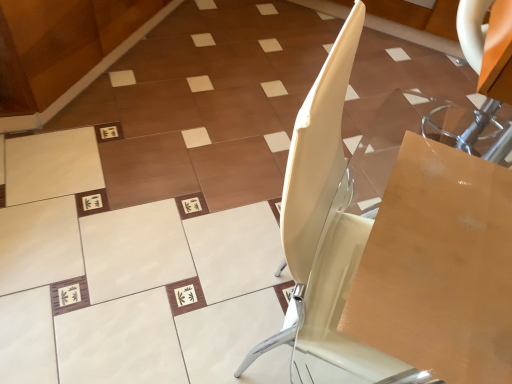
The width and height of the screenshot is (512, 384). In order to click on wooden cardboard box at center-right in this screenshot , I will do `click(439, 266)`.

Where is `transparent acrylic table at upper right`? This screenshot has height=384, width=512. transparent acrylic table at upper right is located at coordinates (422, 136).

Locate an element on the screen. The height and width of the screenshot is (384, 512). white glossy chair at center is located at coordinates (396, 240).

Is white glossy chair at center facing away from transparent acrylic table at upper right?

That's not correct — white glossy chair at center is not looking away from transparent acrylic table at upper right.

Is white glossy chair at center wider than transparent acrylic table at upper right?

Correct, the width of white glossy chair at center exceeds that of transparent acrylic table at upper right.

Based on the photo, from a real-world perspective, which object rests below the other?

In real-world perspective, transparent acrylic table at upper right is lower.

Is white glossy chair at center positioned behind transparent acrylic table at upper right?

No, the depth of white glossy chair at center is less than that of transparent acrylic table at upper right.

Could you tell me if transparent acrylic table at upper right is turned towards white glossy chair at center?

Yes, transparent acrylic table at upper right is facing white glossy chair at center.

Find the location of a particular element. This screenshot has height=384, width=512. glass table behind the white glossy chair at center is located at coordinates (422, 136).

Measure the distance between transparent acrylic table at upper right and white glossy chair at center.

transparent acrylic table at upper right is 11.04 inches away from white glossy chair at center.

From a real-world perspective, is transparent acrylic table at upper right under white glossy chair at center?

Yes, from a real-world perspective, transparent acrylic table at upper right is under white glossy chair at center.

Could you measure the distance between wooden cardboard box at center-right and transparent acrylic table at upper right?

wooden cardboard box at center-right is 28.01 inches from transparent acrylic table at upper right.

Are wooden cardboard box at center-right and transparent acrylic table at upper right beside each other?

No, wooden cardboard box at center-right is not in contact with transparent acrylic table at upper right.

Which object is positioned more to the left, wooden cardboard box at center-right or transparent acrylic table at upper right?

From the viewer's perspective, wooden cardboard box at center-right appears more on the left side.

Is wooden cardboard box at center-right taller than transparent acrylic table at upper right?

In fact, wooden cardboard box at center-right may be shorter than transparent acrylic table at upper right.

This screenshot has width=512, height=384. I want to click on glass table above the wooden cardboard box at center-right (from the image's perspective), so click(422, 136).

Which is closer to the camera, (x=486, y=146) or (x=453, y=368)?

Point (x=453, y=368)

Visually, is transparent acrylic table at upper right positioned to the left or to the right of wooden cardboard box at center-right?

Based on their positions, transparent acrylic table at upper right is located to the right of wooden cardboard box at center-right.

Is transparent acrylic table at upper right positioned with its back to wooden cardboard box at center-right?

No, transparent acrylic table at upper right's orientation is not away from wooden cardboard box at center-right.

Can you confirm if white glossy chair at center is smaller than wooden cardboard box at center-right?

Incorrect, white glossy chair at center is not smaller in size than wooden cardboard box at center-right.

Is white glossy chair at center to the right of wooden cardboard box at center-right from the viewer's perspective?

Incorrect, white glossy chair at center is not on the right side of wooden cardboard box at center-right.

Is white glossy chair at center inside or outside of wooden cardboard box at center-right?

The correct answer is: outside.

Considering the sizes of objects wooden cardboard box at center-right and white glossy chair at center in the image provided, who is shorter, wooden cardboard box at center-right or white glossy chair at center?

Standing shorter between the two is wooden cardboard box at center-right.

Considering the relative positions of wooden cardboard box at center-right and white glossy chair at center in the image provided, is wooden cardboard box at center-right in front of white glossy chair at center?

No, wooden cardboard box at center-right is further to the viewer.

Which object is positioned more to the right, wooden cardboard box at center-right or white glossy chair at center?

wooden cardboard box at center-right.

Which of these two, wooden cardboard box at center-right or white glossy chair at center, is bigger?

white glossy chair at center.

This screenshot has height=384, width=512. What are the coordinates of `glass table behind the white glossy chair at center` in the screenshot? It's located at (422, 136).

Locate an element on the screen. The width and height of the screenshot is (512, 384). furniture above the transparent acrylic table at upper right (from a real-world perspective) is located at coordinates (396, 240).

Estimate the real-world distances between objects in this image. Which object is further from wooden cardboard box at center-right, transparent acrylic table at upper right or white glossy chair at center?

The object further to wooden cardboard box at center-right is transparent acrylic table at upper right.

Looking at the image, which one is located closer to transparent acrylic table at upper right, white glossy chair at center or wooden cardboard box at center-right?

The object closer to transparent acrylic table at upper right is white glossy chair at center.

From the image, which object appears to be farther from transparent acrylic table at upper right, wooden cardboard box at center-right or white glossy chair at center?

wooden cardboard box at center-right lies further to transparent acrylic table at upper right than the other object.

Based on their spatial positions, is wooden cardboard box at center-right or transparent acrylic table at upper right closer to white glossy chair at center?

Based on the image, wooden cardboard box at center-right appears to be nearer to white glossy chair at center.

Considering their positions, is transparent acrylic table at upper right positioned further to white glossy chair at center than wooden cardboard box at center-right?

transparent acrylic table at upper right lies further to white glossy chair at center than the other object.

Based on their spatial positions, is white glossy chair at center or transparent acrylic table at upper right further from wooden cardboard box at center-right?

transparent acrylic table at upper right is positioned further to the anchor wooden cardboard box at center-right.

Find the location of `cardboard box located between white glossy chair at center and transparent acrylic table at upper right in the depth direction`. cardboard box located between white glossy chair at center and transparent acrylic table at upper right in the depth direction is located at coordinates (439, 266).